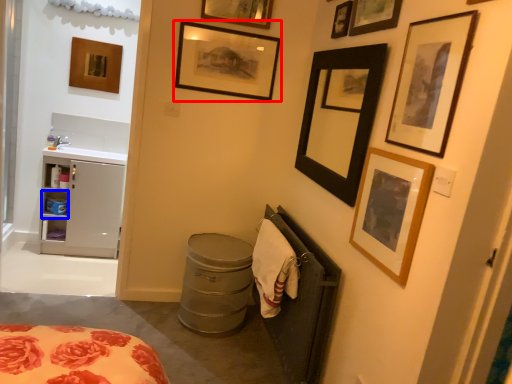
Question: Which object is closer to the camera taking this photo, picture frame (highlighted by a red box) or cabinet (highlighted by a blue box)?

Choices:
 (A) picture frame
 (B) cabinet

Answer: (A)